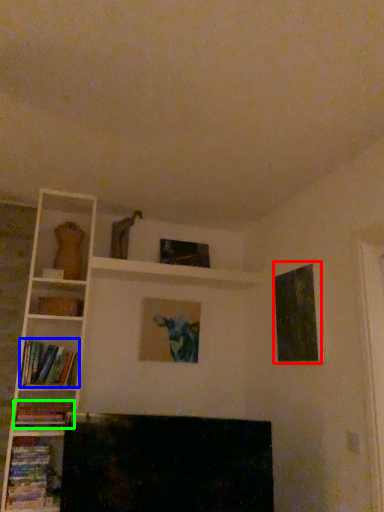
Question: Which object is the closest to the picture frame (highlighted by a red box)? Choose among these: book (highlighted by a blue box) or book (highlighted by a green box).

Choices:
 (A) book
 (B) book

Answer: (A)